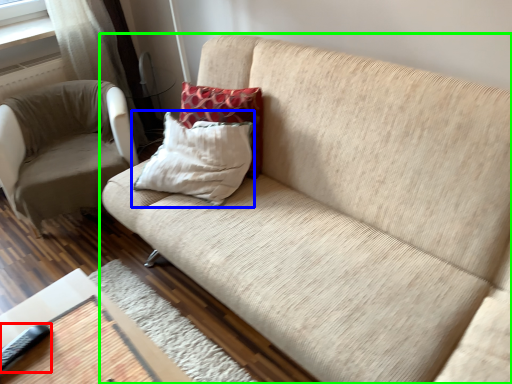
Question: Based on their relative distances, which object is farther from remote (highlighted by a red box)? Choose from pillow (highlighted by a blue box) and studio couch (highlighted by a green box).

Choices:
 (A) pillow
 (B) studio couch

Answer: (B)